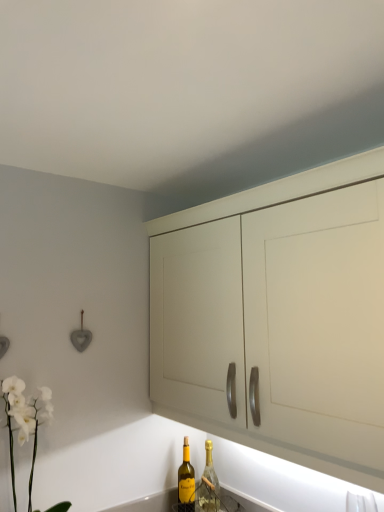
Question: Is there a large distance between gold foil champagne bottle at lower center, which is the first bottle in right-to-left order, and white matte orchid at lower left?

Choices:
 (A) no
 (B) yes

Answer: (A)

Question: Is gold foil champagne bottle at lower center, the second bottle from the left, not within white matte orchid at lower left?

Choices:
 (A) yes
 (B) no

Answer: (A)

Question: Can you confirm if gold foil champagne bottle at lower center, the second bottle from the left, is bigger than white matte orchid at lower left?

Choices:
 (A) yes
 (B) no

Answer: (B)

Question: Is gold foil champagne bottle at lower center, which is the first bottle in right-to-left order, turned away from white matte orchid at lower left?

Choices:
 (A) no
 (B) yes

Answer: (A)

Question: Does gold foil champagne bottle at lower center, which is the first bottle in right-to-left order, have a lesser height compared to white matte orchid at lower left?

Choices:
 (A) no
 (B) yes

Answer: (B)

Question: Can you confirm if gold foil champagne bottle at lower center, the second bottle from the left, is wider than white matte orchid at lower left?

Choices:
 (A) no
 (B) yes

Answer: (A)

Question: Is matte white cabinet at center facing away from gold foil champagne bottle at lower center, the second bottle from the left?

Choices:
 (A) no
 (B) yes

Answer: (A)

Question: Does matte white cabinet at center have a greater height compared to gold foil champagne bottle at lower center, the second bottle from the left?

Choices:
 (A) yes
 (B) no

Answer: (A)

Question: From a real-world perspective, is matte white cabinet at center on top of gold foil champagne bottle at lower center, the second bottle from the left?

Choices:
 (A) no
 (B) yes

Answer: (B)

Question: Is the position of matte white cabinet at center less distant than that of gold foil champagne bottle at lower center, which is the first bottle in right-to-left order?

Choices:
 (A) yes
 (B) no

Answer: (A)

Question: Is gold foil champagne bottle at lower center, the second bottle from the left, located within matte white cabinet at center?

Choices:
 (A) yes
 (B) no

Answer: (B)

Question: Is matte white cabinet at center aimed at gold foil champagne bottle at lower center, the second bottle from the left?

Choices:
 (A) no
 (B) yes

Answer: (A)

Question: Considering the relative sizes of matte white cabinet at center and white matte orchid at lower left in the image provided, is matte white cabinet at center wider than white matte orchid at lower left?

Choices:
 (A) yes
 (B) no

Answer: (A)